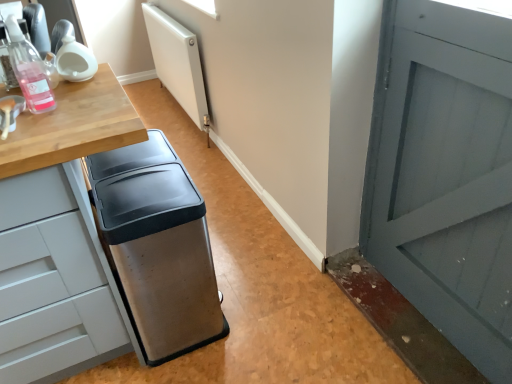
This screenshot has height=384, width=512. I want to click on vacant point above stainless steel trash can at center (from a real-world perspective), so click(x=126, y=177).